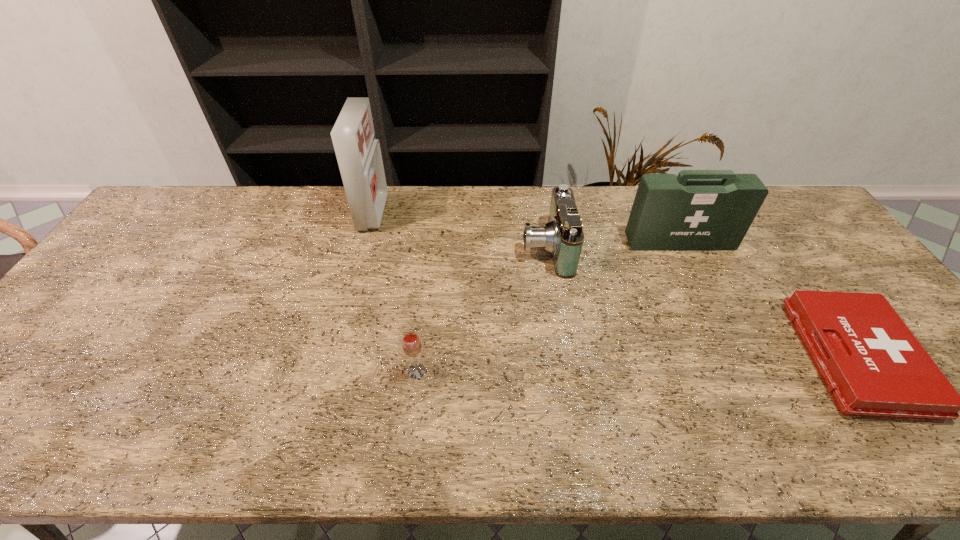
Identify the location of the leftmost first-aid kit. (358, 152).

This screenshot has height=540, width=960. I want to click on the tallest object, so click(x=358, y=152).

This screenshot has width=960, height=540. Identify the location of the second object from right to left. (699, 210).

The height and width of the screenshot is (540, 960). Identify the location of the second shortest first-aid kit. (x=699, y=210).

This screenshot has width=960, height=540. In order to click on camcorder in this screenshot , I will do `click(562, 236)`.

What are the coordinates of `the second object from left to right` in the screenshot? It's located at (411, 344).

This screenshot has height=540, width=960. Identify the location of vacant space located on the front-facing side of the leftmost first-aid kit. (487, 213).

This screenshot has height=540, width=960. I want to click on vacant space located 0.260m on the front-facing side of the fourth object from left to right, so click(715, 318).

Identify the location of free location located on the front-facing side of the third object from right to left. The height and width of the screenshot is (540, 960). (425, 248).

Where is `vacant space located on the front-facing side of the third object from right to left`? vacant space located on the front-facing side of the third object from right to left is located at coordinates [475, 248].